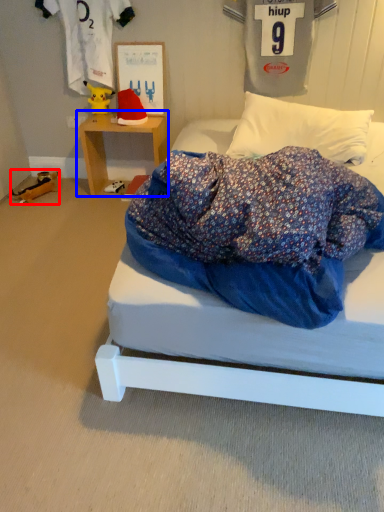
Question: Which of the following is the farthest to the observer, toy (highlighted by a red box) or table (highlighted by a blue box)?

Choices:
 (A) toy
 (B) table

Answer: (A)